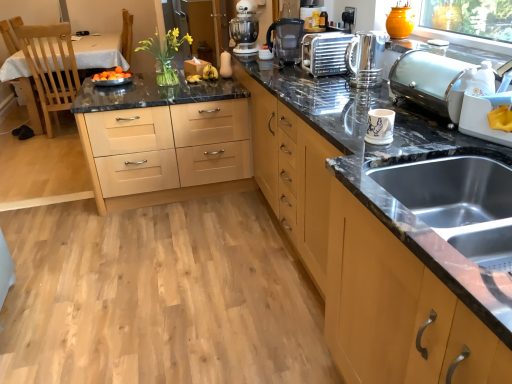
Question: Should I look upward or downward to see satin silver toaster at upper right, which is the 1th appliance in right-to-left order?

Choices:
 (A) up
 (B) down

Answer: (A)

Question: Considering the relative sizes of satin silver toaster at upper right, the 2th appliance in the back-to-front sequence, and white matte stand mixer at center in the image provided, is satin silver toaster at upper right, the 2th appliance in the back-to-front sequence, wider than white matte stand mixer at center?

Choices:
 (A) no
 (B) yes

Answer: (A)

Question: Are satin silver toaster at upper right, which is the 1th appliance in right-to-left order, and white matte stand mixer at center located far from each other?

Choices:
 (A) yes
 (B) no

Answer: (A)

Question: Could you tell me if satin silver toaster at upper right, marked as the third appliance in a left-to-right arrangement, is facing white matte stand mixer at center?

Choices:
 (A) yes
 (B) no

Answer: (B)

Question: Is satin silver toaster at upper right, marked as the third appliance in a left-to-right arrangement, located outside white matte stand mixer at center?

Choices:
 (A) no
 (B) yes

Answer: (B)

Question: Can you confirm if satin silver toaster at upper right, marked as the 2th appliance in a bottom-to-top arrangement, is shorter than white matte stand mixer at center?

Choices:
 (A) no
 (B) yes

Answer: (B)

Question: Is satin silver toaster at upper right, marked as the 2th appliance in a bottom-to-top arrangement, oriented away from white matte stand mixer at center?

Choices:
 (A) no
 (B) yes

Answer: (A)

Question: Can you confirm if satin silver toaster at upper center, the first appliance in the top-to-bottom sequence, is shorter than white matte stand mixer at center?

Choices:
 (A) yes
 (B) no

Answer: (A)

Question: Is satin silver toaster at upper center, the first appliance in the top-to-bottom sequence, looking in the opposite direction of white matte stand mixer at center?

Choices:
 (A) no
 (B) yes

Answer: (A)

Question: Is satin silver toaster at upper center, arranged as the 1th appliance when viewed from the left, not inside white matte stand mixer at center?

Choices:
 (A) yes
 (B) no

Answer: (A)

Question: From a real-world perspective, is satin silver toaster at upper center, the 1th appliance when ordered from back to front, positioned under white matte stand mixer at center based on gravity?

Choices:
 (A) no
 (B) yes

Answer: (B)

Question: Is satin silver toaster at upper center, which is the 3th appliance in bottom-to-top order, thinner than white matte stand mixer at center?

Choices:
 (A) no
 (B) yes

Answer: (B)

Question: Is satin silver toaster at upper center, the 3th appliance viewed from the right, next to white matte stand mixer at center?

Choices:
 (A) yes
 (B) no

Answer: (B)

Question: From the image's perspective, does satin silver toaster at upper center, placed as the 3th appliance when sorted from front to back, appear lower than satin silver toaster at upper right, marked as the 2th appliance in a bottom-to-top arrangement?

Choices:
 (A) no
 (B) yes

Answer: (A)